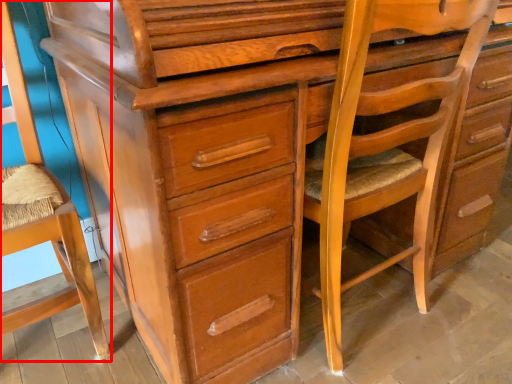
Question: From the image's perspective, where is swivel chair (annotated by the red box) located relative to rocking chair?

Choices:
 (A) above
 (B) below

Answer: (B)